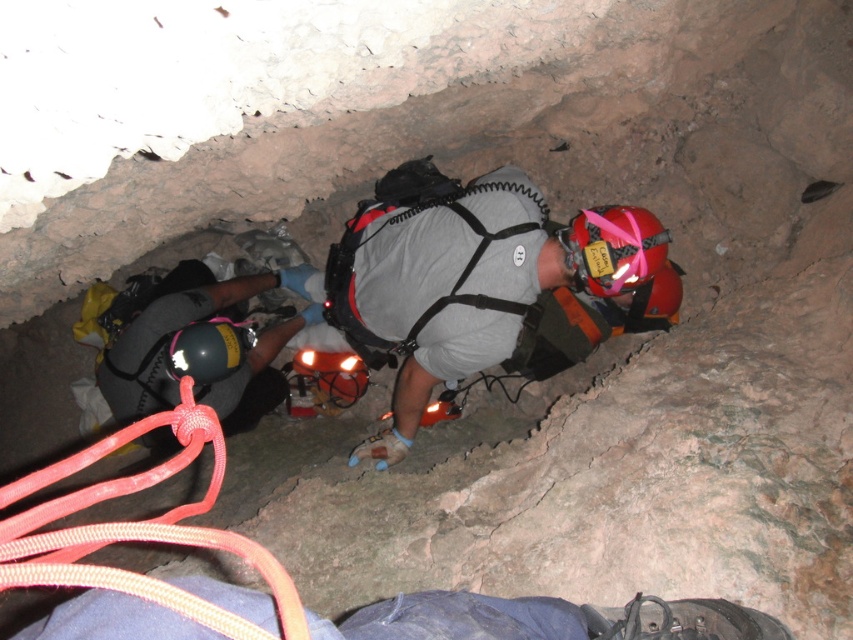
Question: Estimate the real-world distances between objects in this image. Which object is farther from the orange matte helmet at center?

Choices:
 (A) brushed metal helmet at lower left
 (B) red matte helmet at center
 (C) black matte helmet at lower left
 (D) red nylon rope at lower left

Answer: (D)

Question: Does blue fabric bag at lower center appear on the left side of brushed metal helmet at lower left?

Choices:
 (A) yes
 (B) no

Answer: (B)

Question: Considering the relative positions of blue fabric bag at lower center and red nylon rope at lower left in the image provided, where is blue fabric bag at lower center located with respect to red nylon rope at lower left?

Choices:
 (A) below
 (B) above

Answer: (A)

Question: Which is farther from the blue fabric bag at lower center?

Choices:
 (A) brushed metal helmet at lower left
 (B) orange matte helmet at center
 (C) red matte helmet at center

Answer: (B)

Question: Which object is the farthest from the brushed metal helmet at lower left?

Choices:
 (A) orange matte helmet at center
 (B) red matte helmet at center

Answer: (B)

Question: Is brushed metal helmet at lower left in front of red matte helmet at center?

Choices:
 (A) no
 (B) yes

Answer: (A)